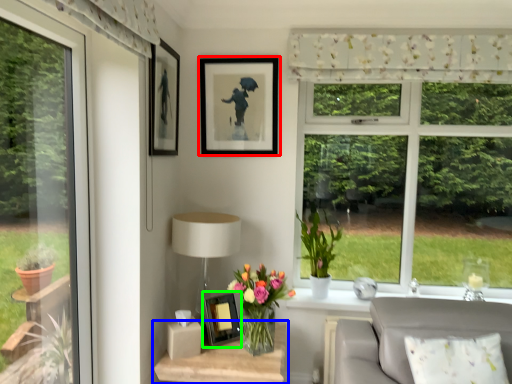
Question: Estimate the real-world distances between objects in this image. Which object is farther from picture frame (highlighted by a red box), table (highlighted by a blue box) or picture frame (highlighted by a green box)?

Choices:
 (A) table
 (B) picture frame

Answer: (A)